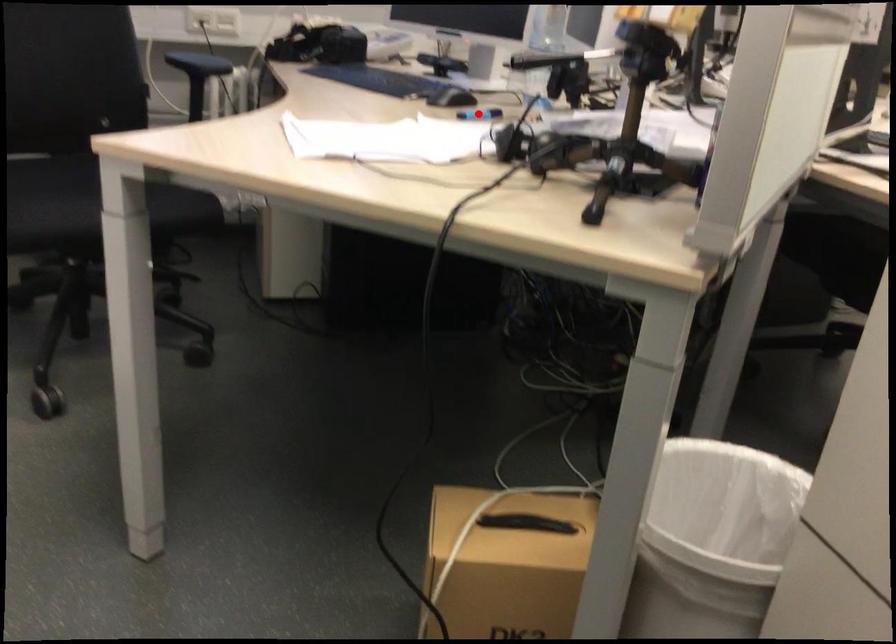
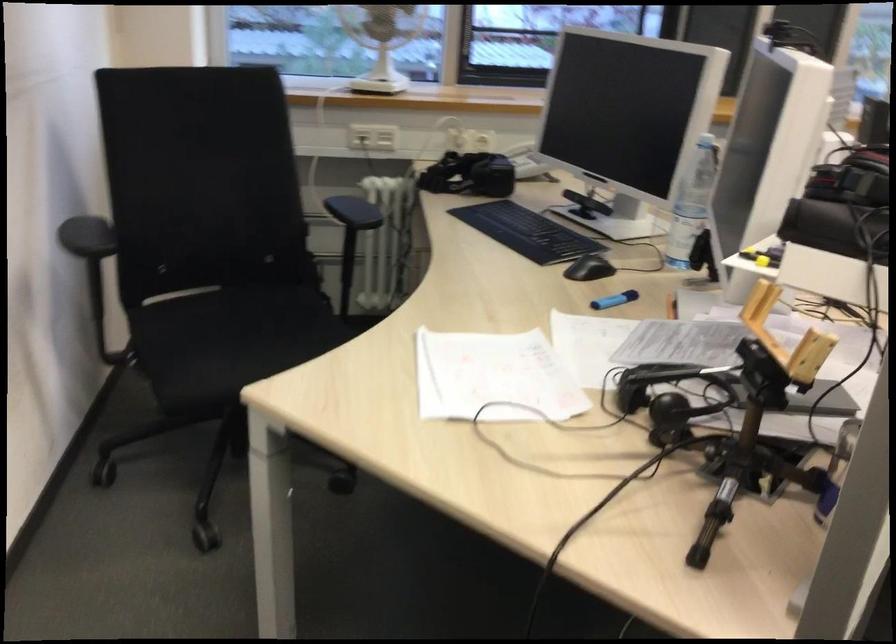
The point at the highlighted location is marked in the first image. Where is the corresponding point in the second image?

(615, 299)